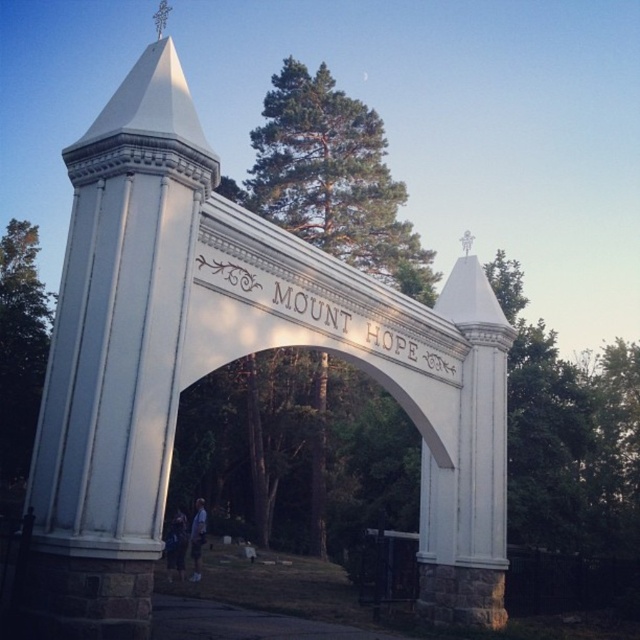
Is green leafy tree at center wider than light blue jeans at center?

Correct, the width of green leafy tree at center exceeds that of light blue jeans at center.

Is green leafy tree at center smaller than light blue jeans at center?

No, green leafy tree at center is not smaller than light blue jeans at center.

Who is more distant from viewer, (420, 282) or (189, 532)?

The point (420, 282) is more distant.

Find the location of a particular element. The image size is (640, 640). green leafy tree at center is located at coordinates (332, 176).

Which of these two, dark blue jeans at lower center or light blue jeans at center, stands taller?

Standing taller between the two is light blue jeans at center.

Is dark blue jeans at lower center smaller than light blue jeans at center?

Incorrect, dark blue jeans at lower center is not smaller in size than light blue jeans at center.

The height and width of the screenshot is (640, 640). I want to click on dark blue jeans at lower center, so click(177, 545).

Looking at this image, does green leafy tree at center have a smaller size compared to dark blue jeans at lower center?

Actually, green leafy tree at center might be larger than dark blue jeans at lower center.

Between green leafy tree at center and dark blue jeans at lower center, which one is positioned higher?

green leafy tree at center is above.

The image size is (640, 640). Find the location of `green leafy tree at center`. green leafy tree at center is located at coordinates (332, 176).